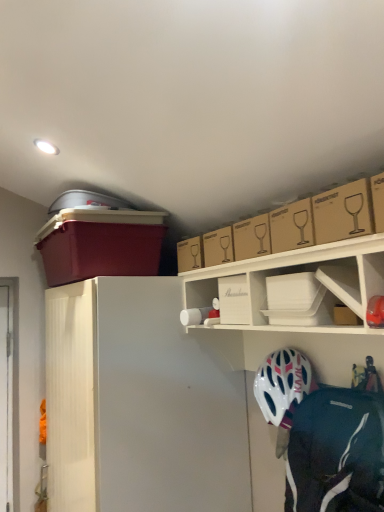
Identify the location of brown cardboard box at upper center, which ranks as the third box in right-to-left order. The image size is (384, 512). (218, 247).

From the picture: How much space does white plastic container at upper center, the 2th box in the front-to-back sequence, occupy vertically?

It is 4.95 inches.

Describe the element at coordinates (6, 398) in the screenshot. I see `transparent plastic screen door at left` at that location.

The width and height of the screenshot is (384, 512). Describe the element at coordinates (324, 435) in the screenshot. I see `white matte helmet at lower right` at that location.

You are a GUI agent. You are given a task and a screenshot of the screen. Output one action in this format:
    pyautogui.click(x=<x>, y=<y>)
    Task: Click on the white matte helmet at lower right
    
    Given the screenshot: What is the action you would take?
    pyautogui.click(x=324, y=435)

The image size is (384, 512). What do you see at coordinates (296, 272) in the screenshot?
I see `white matte shelf at upper center` at bounding box center [296, 272].

Where is `white matte shelf at upper center`? The width and height of the screenshot is (384, 512). white matte shelf at upper center is located at coordinates (296, 272).

The width and height of the screenshot is (384, 512). I want to click on brown cardboard box at upper center, the 2th box from the back, so click(x=218, y=247).

Is there a large distance between transparent plastic screen door at left and brown cardboard box at upper right, which ranks as the 1th box in front-to-back order?

transparent plastic screen door at left is far away from brown cardboard box at upper right, which ranks as the 1th box in front-to-back order.

Considering the relative sizes of transparent plastic screen door at left and brown cardboard box at upper right, marked as the 4th box in a back-to-front arrangement, in the image provided, is transparent plastic screen door at left wider than brown cardboard box at upper right, marked as the 4th box in a back-to-front arrangement,?

No.

Can you confirm if transparent plastic screen door at left is positioned to the left of brown cardboard box at upper right, which ranks as the 1th box in front-to-back order?

Yes, transparent plastic screen door at left is to the left of brown cardboard box at upper right, which ranks as the 1th box in front-to-back order.

How much distance is there between transparent plastic screen door at left and brown cardboard box at upper right, which ranks as the 1th box in front-to-back order?

They are 6.02 feet apart.

Is white matte helmet at lower right aimed at white matte shelf at upper center?

No, white matte helmet at lower right is not oriented towards white matte shelf at upper center.

Is white matte helmet at lower right beside white matte shelf at upper center?

white matte helmet at lower right and white matte shelf at upper center are clearly separated.

Considering the relative sizes of white matte helmet at lower right and white matte shelf at upper center in the image provided, is white matte helmet at lower right smaller than white matte shelf at upper center?

No, white matte helmet at lower right is not smaller than white matte shelf at upper center.

Locate an element on the screen. Image resolution: width=384 pixels, height=512 pixels. shelf lying on the left of white matte helmet at lower right is located at coordinates (296, 272).

Is brown cardboard box at upper center, which ranks as the third box in right-to-left order, oriented away from white matte refrigerator at left?

No.

Does brown cardboard box at upper center, the 2th box from the back, appear on the left side of white matte refrigerator at left?

Incorrect, brown cardboard box at upper center, the 2th box from the back, is not on the left side of white matte refrigerator at left.

Is white matte refrigerator at left completely or partially inside brown cardboard box at upper center, the 2th box from the back?

No, white matte refrigerator at left is not inside brown cardboard box at upper center, the 2th box from the back.

Does brown cardboard box at upper center, arranged as the third box when viewed from the front, touch white matte refrigerator at left?

No, brown cardboard box at upper center, arranged as the third box when viewed from the front, is not in contact with white matte refrigerator at left.

Which object is positioned more to the left, brown cardboard box at upper right, which is counted as the 1th box, starting from the right, or white matte helmet at lower right?

Positioned to the left is white matte helmet at lower right.

Is brown cardboard box at upper right, which is counted as the 1th box, starting from the right, directly adjacent to white matte helmet at lower right?

No, brown cardboard box at upper right, which is counted as the 1th box, starting from the right, is not in contact with white matte helmet at lower right.

Is brown cardboard box at upper right, which ranks as the 1th box in front-to-back order, positioned with its back to white matte helmet at lower right?

That's not correct — brown cardboard box at upper right, which ranks as the 1th box in front-to-back order, is not looking away from white matte helmet at lower right.

Is brown cardboard box at upper right, marked as the 4th box in a back-to-front arrangement, surrounding white matte helmet at lower right?

That's incorrect, white matte helmet at lower right is not inside brown cardboard box at upper right, marked as the 4th box in a back-to-front arrangement.

From the image's perspective, does white matte refrigerator at left appear higher than white matte shelf at upper center?

No, from the image's perspective, white matte refrigerator at left is not above white matte shelf at upper center.

Is white matte refrigerator at left spatially inside white matte shelf at upper center, or outside of it?

white matte refrigerator at left lies outside white matte shelf at upper center.

What's the angular difference between white matte refrigerator at left and white matte shelf at upper center's facing directions?

There is a 0.00483-degree angle between the facing directions of white matte refrigerator at left and white matte shelf at upper center.

How distant is white matte refrigerator at left from white matte shelf at upper center?

A distance of 45.33 centimeters exists between white matte refrigerator at left and white matte shelf at upper center.

Is brown cardboard box at upper right closer to the viewer compared to white plastic container at upper center, the 2th box in the front-to-back sequence?

Yes, brown cardboard box at upper right is closer to the camera.

Which point is more forward, [338,237] or [307,287]?

Point [338,237]

Does brown cardboard box at upper right have a larger size compared to white plastic container at upper center, marked as the 3th box in a back-to-front arrangement?

Indeed, brown cardboard box at upper right has a larger size compared to white plastic container at upper center, marked as the 3th box in a back-to-front arrangement.

Does brown cardboard box at upper right turn towards white plastic container at upper center, placed as the second box when sorted from right to left?

No, brown cardboard box at upper right is not aimed at white plastic container at upper center, placed as the second box when sorted from right to left.

The image size is (384, 512). What are the coordinates of `cardboard box in front of the white plastic container at upper center, positioned as the third box in left-to-right order` in the screenshot? It's located at 343,212.

Based on their sizes in the image, would you say white plastic container at upper center, placed as the second box when sorted from right to left, is bigger or smaller than brown cardboard box at upper right?

white plastic container at upper center, placed as the second box when sorted from right to left, is smaller than brown cardboard box at upper right.

Which object is positioned more to the right, white plastic container at upper center, positioned as the third box in left-to-right order, or brown cardboard box at upper right?

brown cardboard box at upper right is more to the right.

Could you tell me if white plastic container at upper center, placed as the second box when sorted from right to left, is turned towards brown cardboard box at upper right?

No.

Locate an element on the screen. box that is the 4th one when counting forward from the transparent plastic screen door at left is located at coordinates (378, 201).

Identify the location of mountain biker below the white matte shelf at upper center (from the image's perspective). The height and width of the screenshot is (512, 384). (324, 435).

Estimate the real-world distances between objects in this image. Which object is closer to matte plastic storage bin at upper left, which is the 1th box in back-to-front order, brown cardboard box at upper right, which ranks as the 1th box in front-to-back order, or white matte helmet at lower right?

white matte helmet at lower right.

Based on their spatial positions, is white matte shelf at upper center or matte plastic storage bin at upper left, which is the 1th box in back-to-front order, further from brown cardboard box at upper right, which ranks as the 1th box in front-to-back order?

Among the two, matte plastic storage bin at upper left, which is the 1th box in back-to-front order, is located further to brown cardboard box at upper right, which ranks as the 1th box in front-to-back order.

Which object lies further to the anchor point white matte helmet at lower right, white matte shelf at upper center or white matte refrigerator at left?

white matte refrigerator at left.

When comparing their distances from white matte shelf at upper center, does white matte helmet at lower right or matte plastic storage bin at upper left, which is the 1th box in back-to-front order, seem closer?

white matte helmet at lower right is positioned closer to the anchor white matte shelf at upper center.

Looking at this image, from the image, which object appears to be farther from transparent plastic screen door at left, white matte helmet at lower right or white matte refrigerator at left?

Based on the image, white matte helmet at lower right appears to be further to transparent plastic screen door at left.

When comparing their distances from transparent plastic screen door at left, does brown cardboard box at upper right, which is counted as the 1th box, starting from the right, or white matte helmet at lower right seem further?

Among the two, brown cardboard box at upper right, which is counted as the 1th box, starting from the right, is located further to transparent plastic screen door at left.

Considering their positions, is brown cardboard box at upper right, the 4th box from the left, positioned closer to brown cardboard box at upper center, which ranks as the second box in left-to-right order, than white matte shelf at upper center?

white matte shelf at upper center is positioned closer to the anchor brown cardboard box at upper center, which ranks as the second box in left-to-right order.

Looking at this image, estimate the real-world distances between objects in this image. Which object is closer to white matte helmet at lower right, white matte shelf at upper center or transparent plastic screen door at left?

white matte shelf at upper center is closer to white matte helmet at lower right.

Locate an element on the screen. The height and width of the screenshot is (512, 384). shelf between brown cardboard box at upper right, which ranks as the 1th box in front-to-back order, and white matte helmet at lower right, along the z-axis is located at coordinates (296, 272).

In order to click on cardboard box positioned between white matte shelf at upper center and brown cardboard box at upper center, which ranks as the third box in right-to-left order, from near to far in this screenshot , I will do `click(343, 212)`.

Find the location of a particular element. wide between matte plastic storage bin at upper left, which is the 4th box from front to back, and transparent plastic screen door at left vertically is located at coordinates (138, 404).

Where is `mountain biker between transparent plastic screen door at left and brown cardboard box at upper right, which ranks as the 1th box in front-to-back order, from left to right`? The width and height of the screenshot is (384, 512). mountain biker between transparent plastic screen door at left and brown cardboard box at upper right, which ranks as the 1th box in front-to-back order, from left to right is located at coordinates (324, 435).